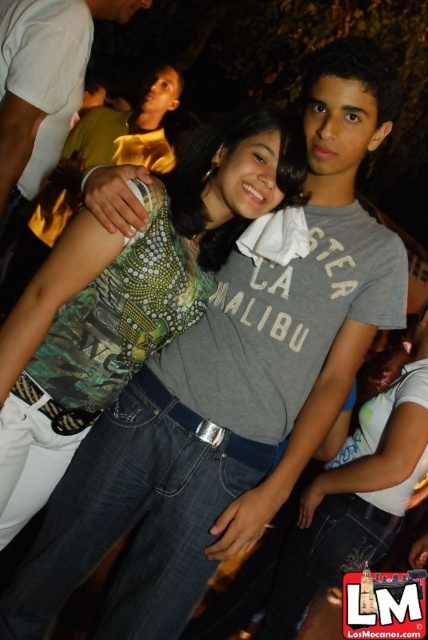
You are a photographer at this event. You want to capture a photo where the green textured top at center is visible above the matte black shirt at upper center. Is this possible given their current positions?

The green textured top at center is positioned under the matte black shirt at upper center, so it cannot be visible above it in the current arrangement.

You are a photographer at this event and need to adjust the lighting so that the green textured top at center and the matte black shirt at upper center are both well lit. Which object should you focus the light on first to ensure both are properly illuminated?

The green textured top at center is taller than the matte black shirt at upper center, so you should focus the light on the green textured top at center first to ensure proper illumination for both.

You are at a party and want to find the exact location of the point with coordinates (127, 296). Based on the scene description, where would this point be located?

The point with coordinates (127, 296) is located on the green textured top at center.